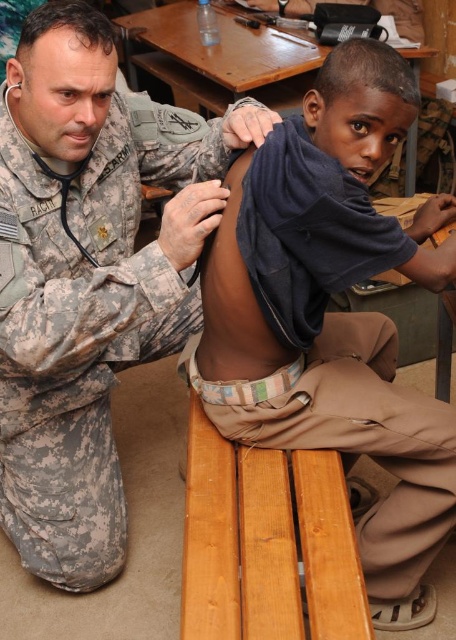
What is the exact coordinate of the camouflage uniform at lower left?

The camouflage uniform at lower left is located at point [87,282].

You are a photographer taking a picture of the scene. You need to ensure both the camouflage uniform at lower left and the dark blue fabric at upper center are visible in the frame. Based on their positions, which object is closer to the left edge of the photo?

The camouflage uniform at lower left is closer to the left edge of the photo because it is positioned to the left of the dark blue fabric at upper center.